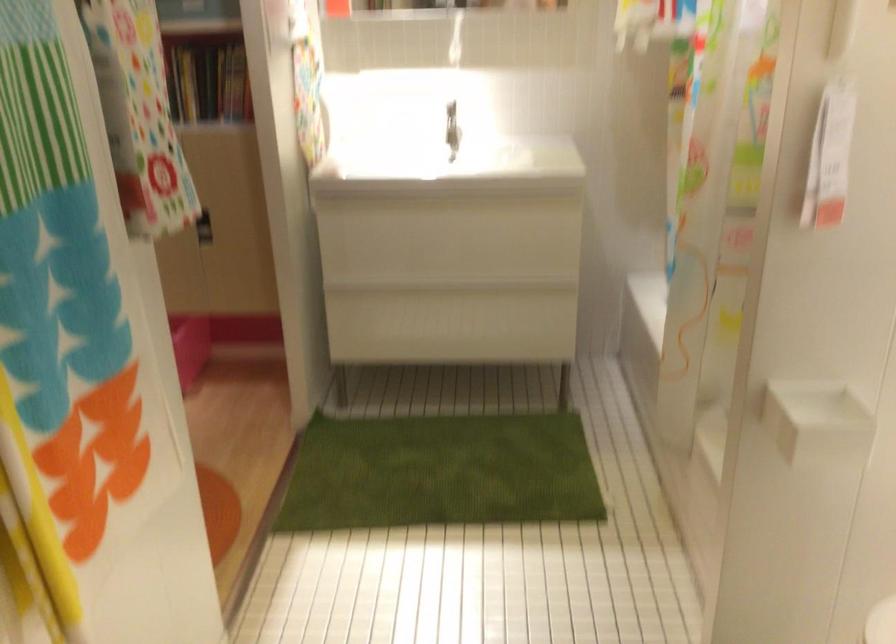
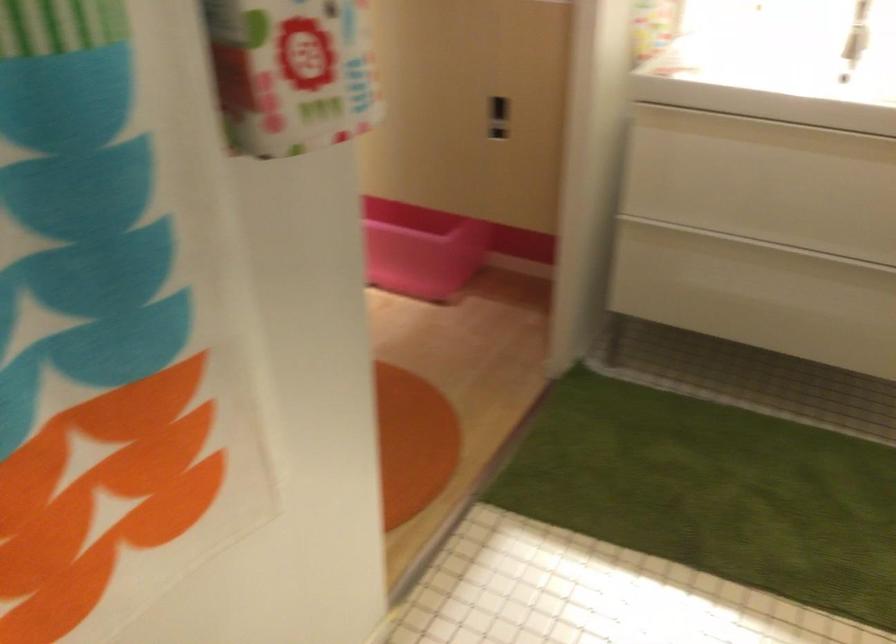
Where in the second image is the point corresponding to point (202, 232) from the first image?

(497, 118)